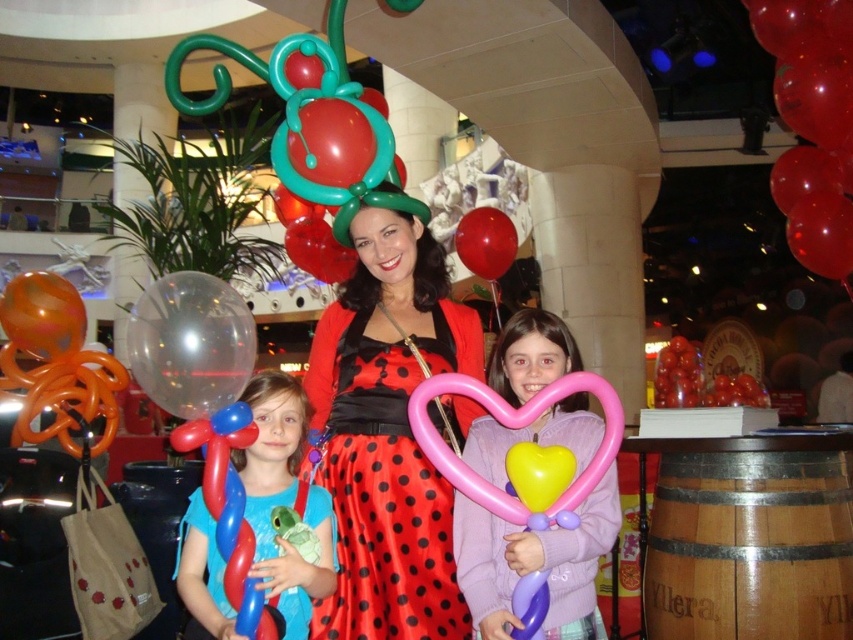
Question: Among these points, which one is farthest from the camera?

Choices:
 (A) (360, 616)
 (B) (234, 296)
 (C) (550, 448)

Answer: (A)

Question: Does red satin dress at center lie in front of red glossy heart at upper right?

Choices:
 (A) no
 (B) yes

Answer: (B)

Question: Estimate the real-world distances between objects in this image. Which object is closer to the red satin dress at center?

Choices:
 (A) red glossy heart at upper right
 (B) shiny metallic balloon at center

Answer: (A)

Question: Which point is farther to the camera?

Choices:
 (A) (502, 221)
 (B) (148, 376)
 (C) (490, 432)
 (D) (509, 474)

Answer: (A)

Question: Does red satin dress at center have a larger size compared to yellow rubber heart at lower center?

Choices:
 (A) yes
 (B) no

Answer: (A)

Question: Does red satin dress at center appear under shiny metallic balloon at center?

Choices:
 (A) no
 (B) yes

Answer: (B)